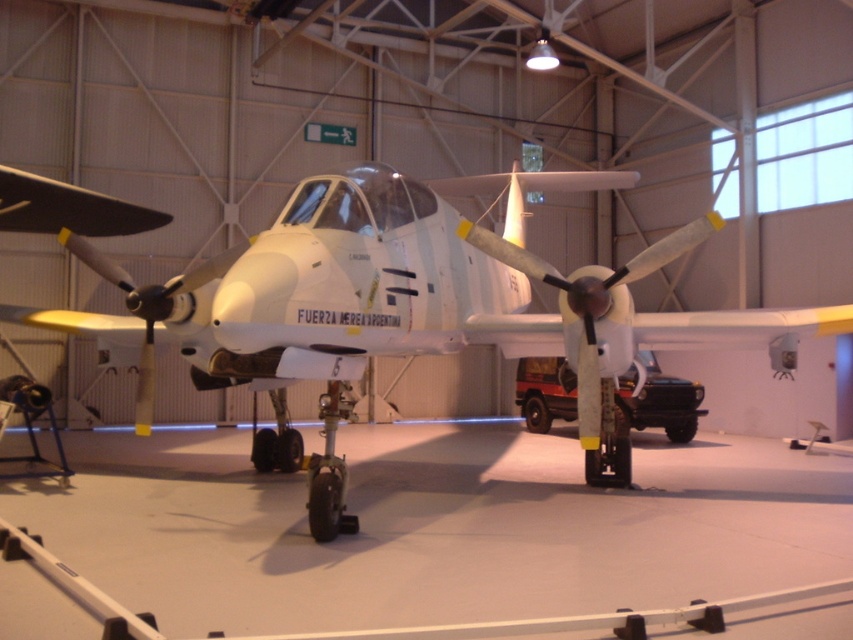
Question: Is white matte airplane at center thinner than white matte propeller at center?

Choices:
 (A) yes
 (B) no

Answer: (A)

Question: Which point is farther from the camera taking this photo?

Choices:
 (A) coord(180,276)
 (B) coord(408,262)

Answer: (A)

Question: Does white matte airplane at center appear over white matte propeller at center?

Choices:
 (A) no
 (B) yes

Answer: (A)

Question: Can you confirm if white matte airplane at center is positioned to the right of white matte propeller at center?

Choices:
 (A) no
 (B) yes

Answer: (B)